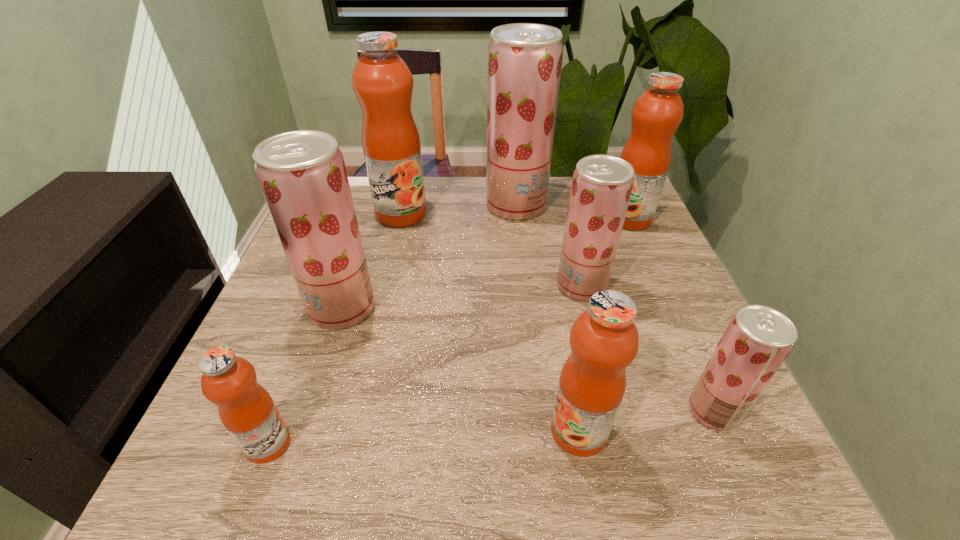
Locate an element on the screen. The height and width of the screenshot is (540, 960). vacant space located on the front label of the biggest orange fruit juice is located at coordinates (385, 282).

Image resolution: width=960 pixels, height=540 pixels. In order to click on vacant region located 0.250m on the right of the third smallest strawberry fruit juice in this screenshot , I will do `click(490, 308)`.

Image resolution: width=960 pixels, height=540 pixels. I want to click on vacant space located 0.260m on the front label of the second biggest orange fruit juice, so click(513, 219).

The height and width of the screenshot is (540, 960). I want to click on vacant area located on the front label of the second biggest orange fruit juice, so click(x=491, y=219).

Find the location of a particular element. This screenshot has width=960, height=540. vacant space located on the front label of the second biggest orange fruit juice is located at coordinates (480, 219).

The image size is (960, 540). What are the coordinates of `free point located on the right of the third biggest strawberry fruit juice` in the screenshot? It's located at (655, 286).

Where is `vacant space located 0.310m on the front label of the second orange fruit juice from right to left`? This screenshot has width=960, height=540. vacant space located 0.310m on the front label of the second orange fruit juice from right to left is located at coordinates (367, 430).

This screenshot has height=540, width=960. In order to click on vacant space located on the front label of the second orange fruit juice from right to left in this screenshot , I will do `click(486, 430)`.

Identify the location of vacant space located on the front label of the second orange fruit juice from right to left. click(396, 430).

This screenshot has width=960, height=540. What are the coordinates of `vacant space situated 0.340m on the back of the nearest strawberry fruit juice` in the screenshot? It's located at (651, 268).